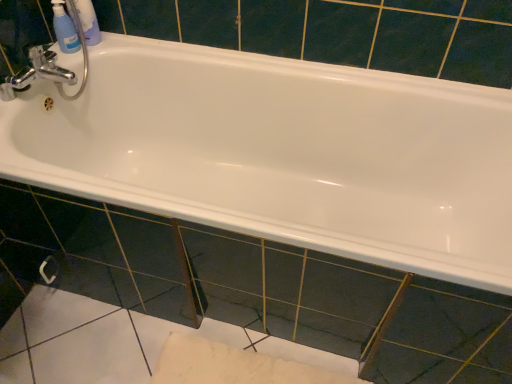
Identify the location of translucent plastic bottles at upper left. (85, 20).

Measure the distance between point (47, 260) and camera.

Point (47, 260) is 4.21 feet from camera.

Find the location of a particular element. This screenshot has height=384, width=512. silver metallic towel bar at lower left is located at coordinates (49, 270).

The image size is (512, 384). I want to click on white glossy bathtub at center, so click(x=283, y=153).

What is the approximate width of glossy ceramic tile at center?

glossy ceramic tile at center is 2.59 inches in width.

The width and height of the screenshot is (512, 384). What do you see at coordinates (48, 67) in the screenshot? I see `chrome metallic faucet at upper left` at bounding box center [48, 67].

You are a GUI agent. You are given a task and a screenshot of the screen. Output one action in this format:
    pyautogui.click(x=<x>, y=<y>)
    Task: Click on the translucent plastic bottles at upper left
    The height and width of the screenshot is (384, 512).
    Given the screenshot: What is the action you would take?
    pyautogui.click(x=85, y=20)

The image size is (512, 384). I want to click on towel bar behind the white glossy bathtub at center, so click(49, 270).

Is silver metallic towel bar at lower left touching white glossy bathtub at center?

No, silver metallic towel bar at lower left is not next to white glossy bathtub at center.

Which of these two, silver metallic towel bar at lower left or white glossy bathtub at center, is thinner?

silver metallic towel bar at lower left.

Considering the relative positions of glossy ceramic tile at center and translucent plastic bottles at upper left in the image provided, is glossy ceramic tile at center to the left or to the right of translucent plastic bottles at upper left?

In the image, glossy ceramic tile at center appears on the right side of translucent plastic bottles at upper left.

In the image, is glossy ceramic tile at center positioned in front of or behind translucent plastic bottles at upper left?

Clearly, glossy ceramic tile at center is in front of translucent plastic bottles at upper left.

Which object is wider, glossy ceramic tile at center or translucent plastic bottles at upper left?

Wider between the two is translucent plastic bottles at upper left.

Considering the positions of objects translucent plastic bottles at upper left and glossy ceramic tile at center in the image provided, who is more to the right, translucent plastic bottles at upper left or glossy ceramic tile at center?

glossy ceramic tile at center is more to the right.

Are translucent plastic bottles at upper left and glossy ceramic tile at center making contact?

No, translucent plastic bottles at upper left is not with glossy ceramic tile at center.

Can you confirm if translucent plastic bottles at upper left is wider than glossy ceramic tile at center?

Yes.

Measure the distance from white glossy bathtub at center to transparent plastic mouthwash at upper left.

white glossy bathtub at center is 27.01 inches from transparent plastic mouthwash at upper left.

From the image's perspective, which object appears higher, white glossy bathtub at center or transparent plastic mouthwash at upper left?

A: transparent plastic mouthwash at upper left is shown above in the image.

Is point (411, 206) positioned behind point (66, 27)?

Yes, point (411, 206) is farther from viewer.

Does white glossy bathtub at center have a larger size compared to transparent plastic mouthwash at upper left?

Indeed, white glossy bathtub at center has a larger size compared to transparent plastic mouthwash at upper left.

From the picture: Can you confirm if translucent plastic bottles at upper left is bigger than silver metallic towel bar at lower left?

Correct, translucent plastic bottles at upper left is larger in size than silver metallic towel bar at lower left.

Based on the photo, from a real-world perspective, is translucent plastic bottles at upper left beneath silver metallic towel bar at lower left?

No, from a real-world perspective, translucent plastic bottles at upper left is not under silver metallic towel bar at lower left.

What's the angular difference between translucent plastic bottles at upper left and silver metallic towel bar at lower left's facing directions?

The angle between the facing direction of translucent plastic bottles at upper left and the facing direction of silver metallic towel bar at lower left is 90 degrees.

From the image's perspective, is transparent plastic mouthwash at upper left above or below silver metallic towel bar at lower left?

transparent plastic mouthwash at upper left is above silver metallic towel bar at lower left.

Who is smaller, transparent plastic mouthwash at upper left or silver metallic towel bar at lower left?

Smaller between the two is silver metallic towel bar at lower left.

Where is `towel bar that appears behind the transparent plastic mouthwash at upper left`? Image resolution: width=512 pixels, height=384 pixels. towel bar that appears behind the transparent plastic mouthwash at upper left is located at coordinates (49, 270).

Which of these two, transparent plastic mouthwash at upper left or silver metallic towel bar at lower left, stands taller?

transparent plastic mouthwash at upper left.

From a real-world perspective, relative to silver metallic towel bar at lower left, is white glossy bathtub at center vertically above or below?

In terms of real-world spatial position, white glossy bathtub at center is above silver metallic towel bar at lower left.

Which object is thinner, white glossy bathtub at center or silver metallic towel bar at lower left?

silver metallic towel bar at lower left is thinner.

Can you confirm if white glossy bathtub at center is positioned to the right of silver metallic towel bar at lower left?

Yes.

Is white glossy bathtub at center oriented away from silver metallic towel bar at lower left?

No, silver metallic towel bar at lower left is not at the back of white glossy bathtub at center.

Locate an element on the screen. bathtub on the right of silver metallic towel bar at lower left is located at coordinates (283, 153).

The image size is (512, 384). Find the location of `toiletry located above the glossy ceramic tile at center (from a real-world perspective)`. toiletry located above the glossy ceramic tile at center (from a real-world perspective) is located at coordinates (85, 20).

Which object lies further to the anchor point transparent plastic mouthwash at upper left, silver metallic towel bar at lower left or translucent plastic bottles at upper left?

Among the two, silver metallic towel bar at lower left is located further to transparent plastic mouthwash at upper left.

Looking at this image, looking at the image, which one is located closer to glossy ceramic tile at center, white glossy bathtub at center or transparent plastic mouthwash at upper left?

white glossy bathtub at center is closer to glossy ceramic tile at center.

Considering their positions, is silver metallic towel bar at lower left positioned further to white glossy bathtub at center than translucent plastic bottles at upper left?

silver metallic towel bar at lower left is positioned further to the anchor white glossy bathtub at center.

When comparing their distances from translucent plastic bottles at upper left, does chrome metallic faucet at upper left or white glossy bathtub at center seem closer?

Based on the image, chrome metallic faucet at upper left appears to be nearer to translucent plastic bottles at upper left.

Estimate the real-world distances between objects in this image. Which object is closer to glossy ceramic tile at center, transparent plastic mouthwash at upper left or silver metallic towel bar at lower left?

Based on the image, silver metallic towel bar at lower left appears to be nearer to glossy ceramic tile at center.

Considering their positions, is glossy ceramic tile at center positioned further to transparent plastic mouthwash at upper left than translucent plastic bottles at upper left?

Based on the image, glossy ceramic tile at center appears to be further to transparent plastic mouthwash at upper left.

Estimate the real-world distances between objects in this image. Which object is further from translucent plastic bottles at upper left, transparent plastic mouthwash at upper left or glossy ceramic tile at center?

The object further to translucent plastic bottles at upper left is glossy ceramic tile at center.

Looking at the image, which one is located closer to transparent plastic mouthwash at upper left, translucent plastic bottles at upper left or white glossy bathtub at center?

Among the two, translucent plastic bottles at upper left is located nearer to transparent plastic mouthwash at upper left.

Identify the location of sink between translucent plastic bottles at upper left and silver metallic towel bar at lower left in the up-down direction. This screenshot has height=384, width=512. (48, 67).

Where is `mouthwash between translucent plastic bottles at upper left and chrome metallic faucet at upper left in the vertical direction`? Image resolution: width=512 pixels, height=384 pixels. mouthwash between translucent plastic bottles at upper left and chrome metallic faucet at upper left in the vertical direction is located at coordinates (64, 29).

This screenshot has width=512, height=384. I want to click on mouthwash between translucent plastic bottles at upper left and glossy ceramic tile at center in the up-down direction, so click(x=64, y=29).

I want to click on sink situated between silver metallic towel bar at lower left and white glossy bathtub at center from left to right, so click(48, 67).